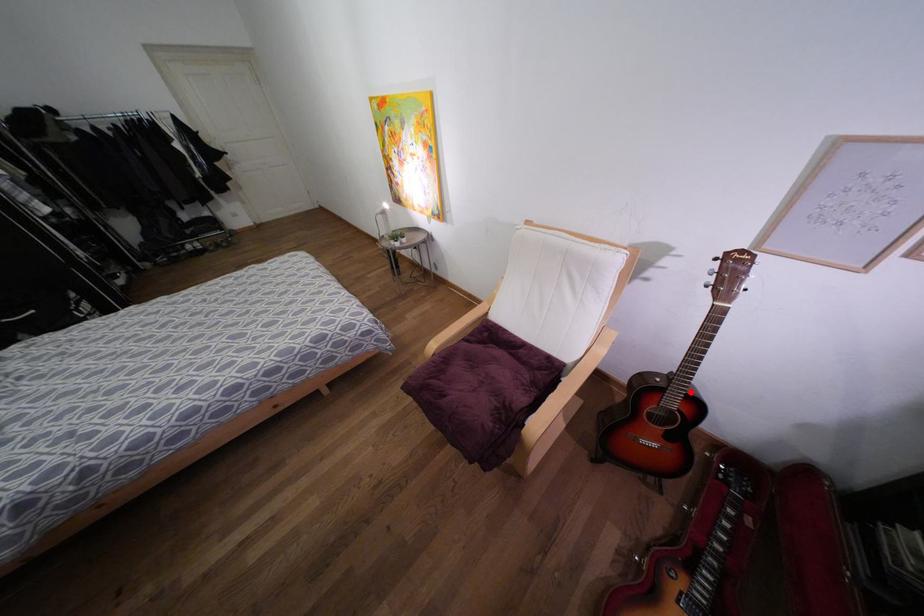
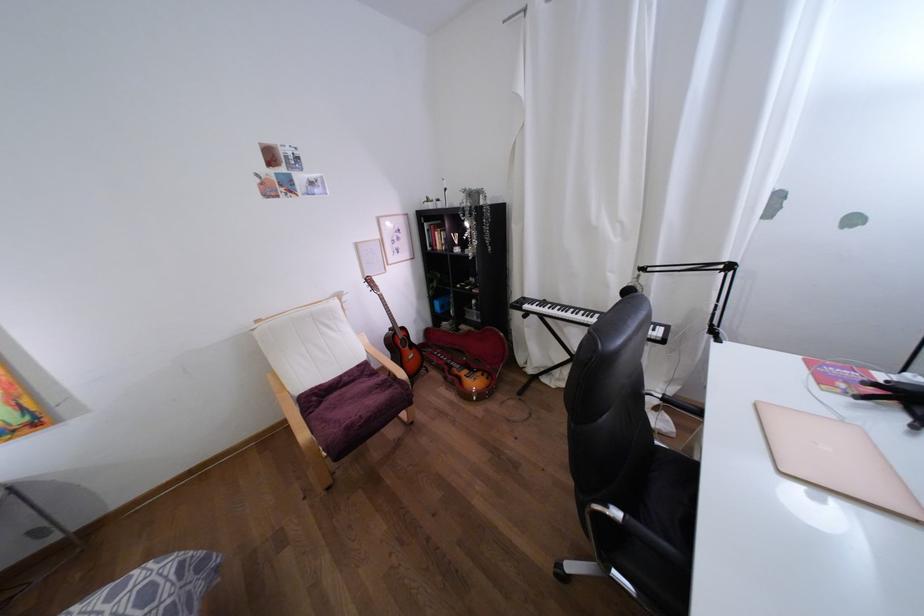
Question: I am providing you with two images of the same scene from different viewpoints. Image1 has a red point marked. In image2, the corresponding 3D location appears at what relative position? Reply with the corresponding letter.

Choices:
 (A) Closer
 (B) Farther

Answer: (A)